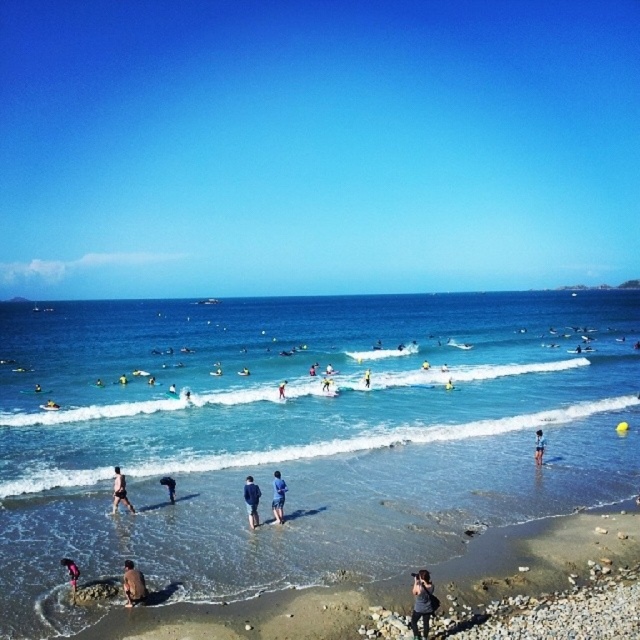
Question: Can you confirm if blue denim shorts at center is positioned above blue fabric person at center?

Choices:
 (A) yes
 (B) no

Answer: (B)

Question: Which of the following is the farthest from the observer?

Choices:
 (A) brown sandy beach at lower center
 (B) pink fabric person at lower left
 (C) dark blue fabric shorts at lower left

Answer: (C)

Question: Does dark gray fabric camera at lower right appear on the left side of blue fabric shorts at lower left?

Choices:
 (A) yes
 (B) no

Answer: (B)

Question: Which point is farther to the camera?

Choices:
 (A) (280, 492)
 (B) (368, 371)
 (C) (253, 529)

Answer: (B)

Question: Which of these objects is positioned farthest from the blue fabric shorts at lower left?

Choices:
 (A) pink fabric person at lower left
 (B) skinny man at lower left
 (C) brown sandy beach at lower center

Answer: (C)

Question: Is dark gray fabric camera at lower right thinner than blue fabric person at center?

Choices:
 (A) yes
 (B) no

Answer: (B)